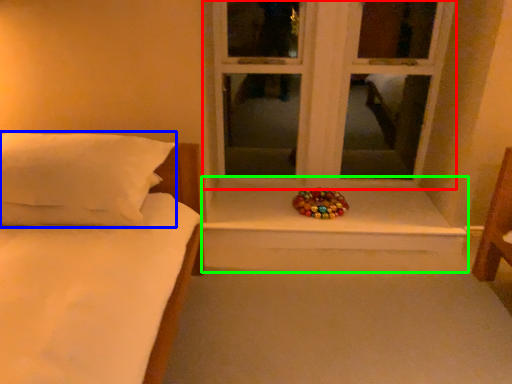
Question: Based on their relative distances, which object is farther from window (highlighted by a red box)? Choose from pillow (highlighted by a blue box) and window sill (highlighted by a green box).

Choices:
 (A) pillow
 (B) window sill

Answer: (A)